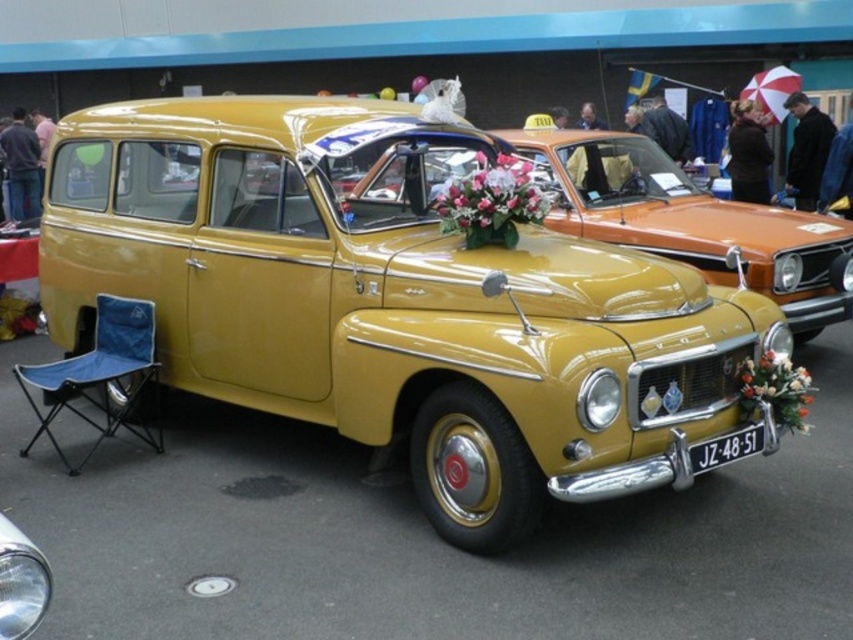
Question: Which point is closer to the camera?

Choices:
 (A) (508, 163)
 (B) (554, 436)

Answer: (B)

Question: From the image, what is the correct spatial relationship of shiny yellow car at center in relation to black plastic license plate at lower center?

Choices:
 (A) left
 (B) right

Answer: (A)

Question: Estimate the real-world distances between objects in this image. Which object is closer to the matte yellow car at center?

Choices:
 (A) pink silk flowers at center
 (B) black plastic license plate at lower center
 (C) shiny yellow car at center
 (D) white floral bouquet at front

Answer: (A)

Question: In this image, where is shiny yellow car at center located relative to matte yellow car at center?

Choices:
 (A) left
 (B) right

Answer: (A)

Question: Which point is closer to the camera?

Choices:
 (A) (595, 179)
 (B) (701, 452)
 (C) (109, 179)
 (D) (786, 378)

Answer: (B)

Question: Where is matte yellow car at center located in relation to black plastic license plate at lower center in the image?

Choices:
 (A) right
 (B) left

Answer: (A)